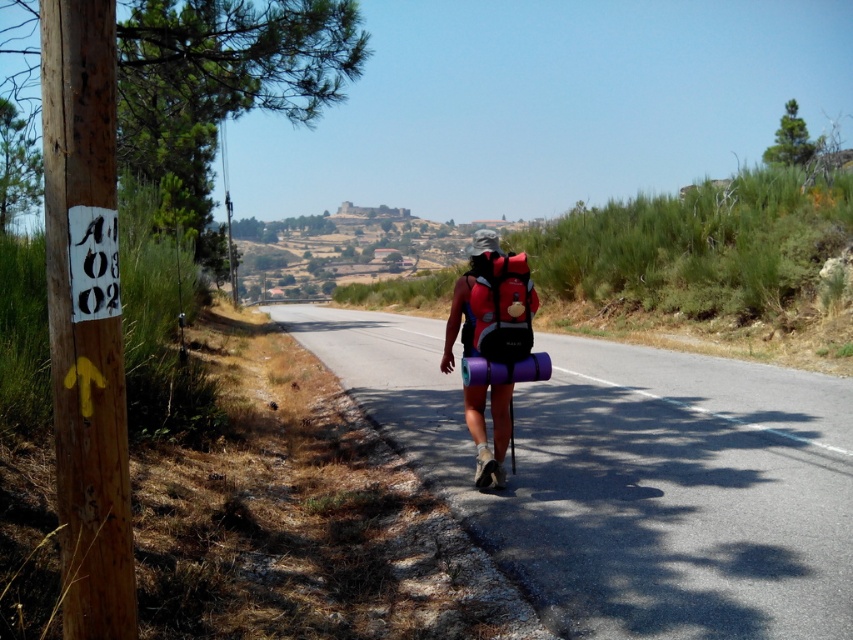
Does purple fabric backpack at center have a lesser height compared to matte red backpack at center?

No.

Between purple fabric backpack at center and matte red backpack at center, which one has less height?

With less height is matte red backpack at center.

Identify the location of purple fabric backpack at center. (491, 305).